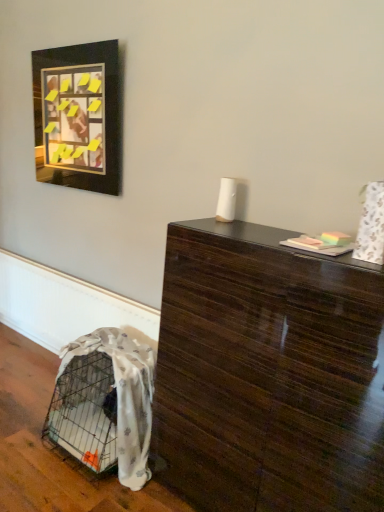
The image size is (384, 512). What do you see at coordinates (267, 375) in the screenshot?
I see `glossy dark wood table at center` at bounding box center [267, 375].

Locate an element on the screen. Image resolution: width=384 pixels, height=512 pixels. glossy dark wood table at center is located at coordinates (267, 375).

Image resolution: width=384 pixels, height=512 pixels. I want to click on white textured blanket at lower left, so click(x=125, y=396).

Considering their positions, is glossy dark wood table at center located in front of or behind white textured blanket at lower left?

Clearly, glossy dark wood table at center is in front of white textured blanket at lower left.

In order to click on blanket behind the glossy dark wood table at center in this screenshot , I will do `click(125, 396)`.

Is white textured blanket at lower left a part of glossy dark wood table at center?

That's incorrect, white textured blanket at lower left is not inside glossy dark wood table at center.

What's the angular difference between glossy dark wood table at center and white textured blanket at lower left's facing directions?

1.56 degrees.

Are black matte picture frame at upper left and white textured blanket at lower left located far from each other?

Yes, black matte picture frame at upper left and white textured blanket at lower left are located far from each other.

From a real-world perspective, which object stands above the other?

black matte picture frame at upper left is physically above.

Measure the distance from black matte picture frame at upper left to white textured blanket at lower left.

They are 1.27 meters apart.

Considering the sizes of objects glossy dark wood table at center and black matte picture frame at upper left in the image provided, who is smaller, glossy dark wood table at center or black matte picture frame at upper left?

black matte picture frame at upper left.

From the image's perspective, does glossy dark wood table at center appear higher than black matte picture frame at upper left?

No, from the image's perspective, glossy dark wood table at center is not over black matte picture frame at upper left.

Is point (332, 268) behind point (111, 84)?

No, it is in front of (111, 84).

Is glossy dark wood table at center thinner than black matte picture frame at upper left?

Incorrect, the width of glossy dark wood table at center is not less than that of black matte picture frame at upper left.

Is white textured blanket at lower left inside the boundaries of black matte picture frame at upper left, or outside?

white textured blanket at lower left cannot be found inside black matte picture frame at upper left.

Does point (74, 355) appear closer or farther from the camera than point (111, 66)?

Clearly, point (74, 355) is closer to the camera than point (111, 66).

From the image's perspective, is white textured blanket at lower left above or below black matte picture frame at upper left?

white textured blanket at lower left is below black matte picture frame at upper left.

You are a GUI agent. You are given a task and a screenshot of the screen. Output one action in this format:
    pyautogui.click(x=<x>, y=<y>)
    Task: Click on the picture frame behind the white textured blanket at lower left
    The width and height of the screenshot is (384, 512).
    Given the screenshot: What is the action you would take?
    pyautogui.click(x=78, y=116)

Does white textured blanket at lower left have a greater width compared to glossy dark wood table at center?

Indeed, white textured blanket at lower left has a greater width compared to glossy dark wood table at center.

From a real-world perspective, between white textured blanket at lower left and glossy dark wood table at center, who is vertically lower?

From a 3D spatial view, white textured blanket at lower left is below.

Considering the positions of objects white textured blanket at lower left and glossy dark wood table at center in the image provided, who is more to the right, white textured blanket at lower left or glossy dark wood table at center?

Positioned to the right is glossy dark wood table at center.

How many degrees apart are the facing directions of white textured blanket at lower left and glossy dark wood table at center?

The angular difference between white textured blanket at lower left and glossy dark wood table at center is 1.56 degrees.

Are black matte picture frame at upper left and glossy dark wood table at center far apart?

Indeed, black matte picture frame at upper left is not near glossy dark wood table at center.

From the image's perspective, which is below, black matte picture frame at upper left or glossy dark wood table at center?

From the image's view, glossy dark wood table at center is below.

Measure the distance from black matte picture frame at upper left to glossy dark wood table at center.

black matte picture frame at upper left and glossy dark wood table at center are 1.41 meters apart.

Considering their positions, is black matte picture frame at upper left located in front of or behind glossy dark wood table at center?

Visually, black matte picture frame at upper left is located behind glossy dark wood table at center.

This screenshot has width=384, height=512. In the image, there is a glossy dark wood table at center. Find the location of `blanket below it (from a real-world perspective)`. blanket below it (from a real-world perspective) is located at coordinates click(x=125, y=396).

At what (x,y) coordinates should I click in order to perform the action: click on picture frame behind the white textured blanket at lower left. Please return your answer as a coordinate pair (x, y). The width and height of the screenshot is (384, 512). Looking at the image, I should click on (78, 116).

From the picture: Which object lies further to the anchor point black matte picture frame at upper left, glossy dark wood table at center or white textured blanket at lower left?

glossy dark wood table at center is further to black matte picture frame at upper left.

Looking at the image, which one is located closer to glossy dark wood table at center, white textured blanket at lower left or black matte picture frame at upper left?

Answer: white textured blanket at lower left.

Based on their spatial positions, is black matte picture frame at upper left or white textured blanket at lower left closer to glossy dark wood table at center?

white textured blanket at lower left is positioned closer to the anchor glossy dark wood table at center.

From the image, which object appears to be nearer to white textured blanket at lower left, black matte picture frame at upper left or glossy dark wood table at center?

glossy dark wood table at center is positioned closer to the anchor white textured blanket at lower left.

Estimate the real-world distances between objects in this image. Which object is closer to white textured blanket at lower left, glossy dark wood table at center or black matte picture frame at upper left?

Among the two, glossy dark wood table at center is located nearer to white textured blanket at lower left.

Based on their spatial positions, is white textured blanket at lower left or glossy dark wood table at center closer to black matte picture frame at upper left?

The object closer to black matte picture frame at upper left is white textured blanket at lower left.

Where is `table that lies between black matte picture frame at upper left and white textured blanket at lower left from top to bottom`? Image resolution: width=384 pixels, height=512 pixels. table that lies between black matte picture frame at upper left and white textured blanket at lower left from top to bottom is located at coordinates (267, 375).